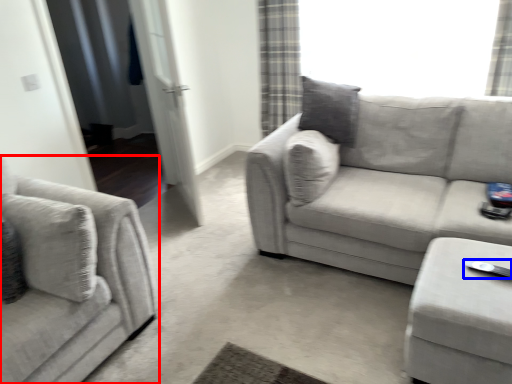
Question: Which object appears farthest to the camera in this image, studio couch (highlighted by a red box) or Wii controller (highlighted by a blue box)?

Choices:
 (A) studio couch
 (B) Wii controller

Answer: (B)